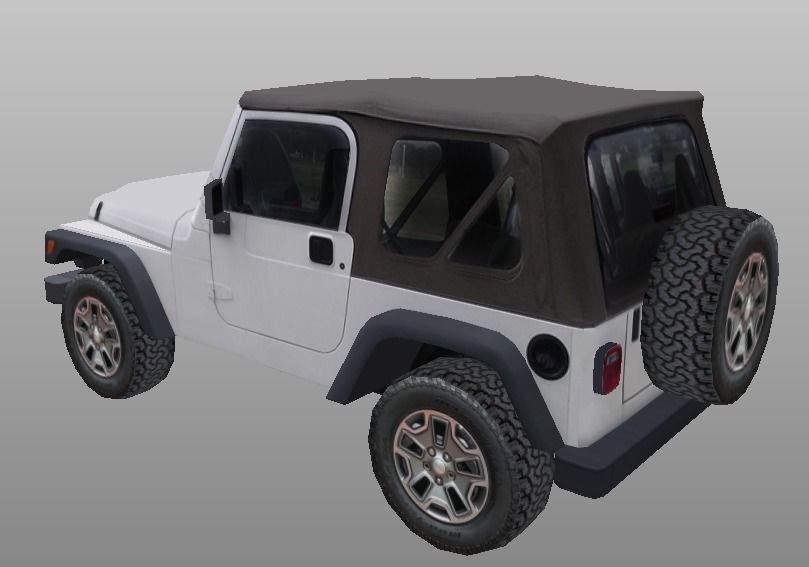
This screenshot has height=567, width=809. Identify the location of window. (293, 171), (451, 207), (653, 181).